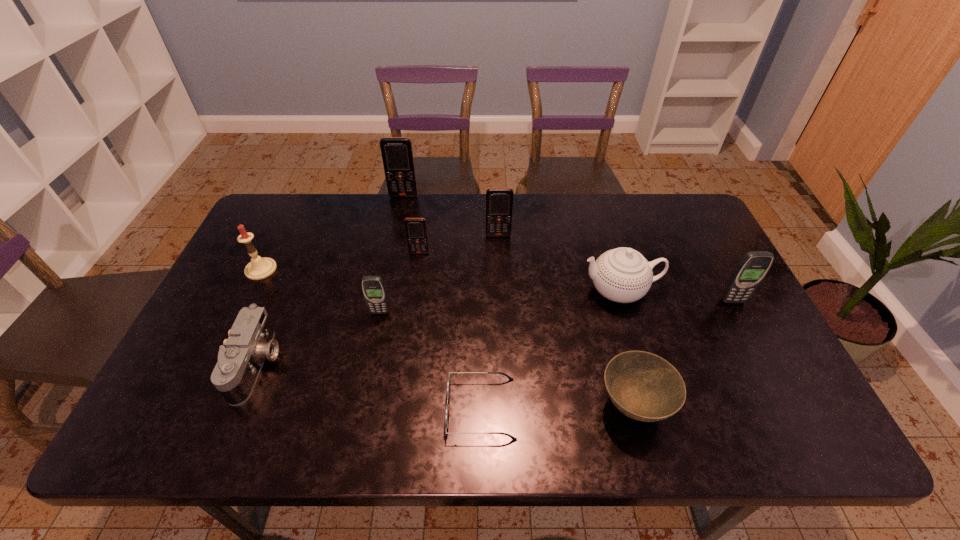
Locate an element on the screen. the third farthest object is located at coordinates (416, 232).

In order to click on the nearer gray cellular telephone in this screenshot , I will do `click(373, 287)`.

What are the coordinates of `the nearest cellular telephone` in the screenshot? It's located at (373, 287).

Where is `the second object from left to right`? The height and width of the screenshot is (540, 960). the second object from left to right is located at coordinates (251, 340).

Identify the location of bowl. (643, 386).

Identify the location of sunglasses. The image size is (960, 540). (448, 384).

Where is `free spot located 0.240m on the screen of the biggest orange cellular telephone`? The width and height of the screenshot is (960, 540). free spot located 0.240m on the screen of the biggest orange cellular telephone is located at coordinates (394, 244).

Identify the location of vacant space situated on the screen of the rightmost object. (796, 421).

Find the location of a particular element. This screenshot has width=960, height=540. vacant space located on the screen of the fourth cellular telephone from left to right is located at coordinates (499, 264).

Where is `vacant area situated 0.060m on the front of the red candle`? This screenshot has height=540, width=960. vacant area situated 0.060m on the front of the red candle is located at coordinates (248, 296).